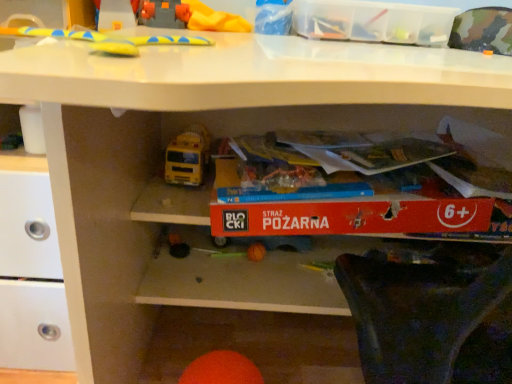
Question: Is yellow rubber toy at upper center, which is counted as the 3th toy, starting from the back, oriented towards orange matte ball at lower center, the third toy from the top?

Choices:
 (A) yes
 (B) no

Answer: (B)

Question: Is the depth of yellow rubber toy at upper center, which appears as the 1th toy when viewed from the front, less than that of orange matte ball at lower center, the 2th toy viewed from the back?

Choices:
 (A) no
 (B) yes

Answer: (B)

Question: Is the position of yellow rubber toy at upper center, the 2th toy in the bottom-to-top sequence, more distant than that of orange matte ball at lower center, the 1th toy when ordered from bottom to top?

Choices:
 (A) no
 (B) yes

Answer: (A)

Question: From the image's perspective, is yellow rubber toy at upper center, the 2th toy in the bottom-to-top sequence, below orange matte ball at lower center, the 1th toy when ordered from bottom to top?

Choices:
 (A) no
 (B) yes

Answer: (A)

Question: From the image's perspective, is yellow rubber toy at upper center, which is the 2th toy from top to bottom, on orange matte ball at lower center, the second toy when ordered from front to back?

Choices:
 (A) no
 (B) yes

Answer: (B)

Question: Is yellow rubber toy at upper center, which appears as the 1th toy when viewed from the front, outside of orange matte ball at lower center, the third toy from the top?

Choices:
 (A) no
 (B) yes

Answer: (B)

Question: Is transparent plastic storage box at upper center outside of yellow rubber toy at upper center, the first toy positioned from the top?

Choices:
 (A) yes
 (B) no

Answer: (A)

Question: Is transparent plastic storage box at upper center facing towards yellow rubber toy at upper center, the first toy positioned from the top?

Choices:
 (A) no
 (B) yes

Answer: (A)

Question: From a real-world perspective, does transparent plastic storage box at upper center stand above yellow rubber toy at upper center, the 3th toy when ordered from front to back?

Choices:
 (A) no
 (B) yes

Answer: (A)

Question: Is transparent plastic storage box at upper center positioned before yellow rubber toy at upper center, acting as the 1th toy starting from the back?

Choices:
 (A) yes
 (B) no

Answer: (A)

Question: Considering the relative sizes of transparent plastic storage box at upper center and yellow rubber toy at upper center, acting as the 1th toy starting from the back, in the image provided, is transparent plastic storage box at upper center bigger than yellow rubber toy at upper center, acting as the 1th toy starting from the back,?

Choices:
 (A) no
 (B) yes

Answer: (A)

Question: Is transparent plastic storage box at upper center oriented away from yellow rubber toy at upper center, acting as the 1th toy starting from the back?

Choices:
 (A) no
 (B) yes

Answer: (A)

Question: Is the position of yellow rubber toy at upper center, the first toy positioned from the top, less distant than that of transparent plastic storage box at upper center?

Choices:
 (A) yes
 (B) no

Answer: (B)